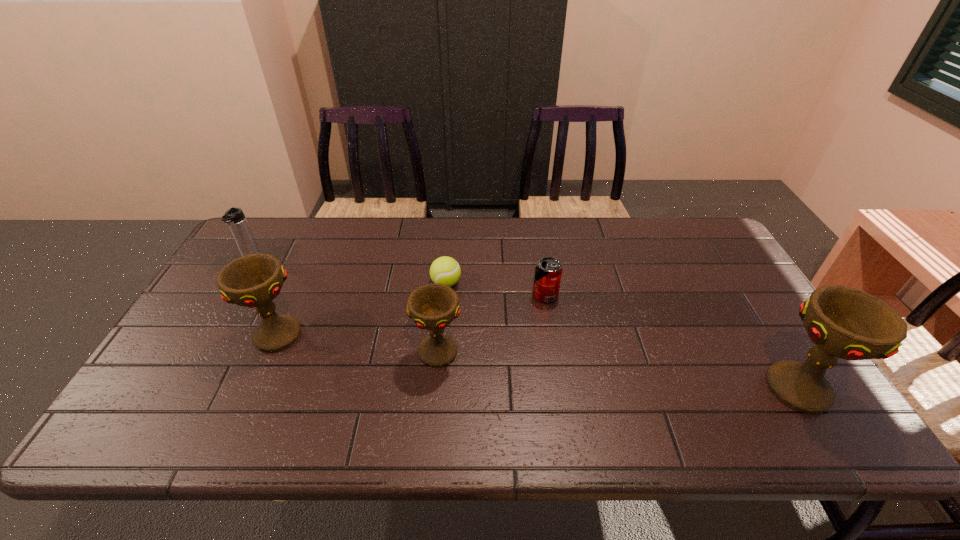
This screenshot has height=540, width=960. In order to click on object present at the near right corner in this screenshot , I will do `click(843, 322)`.

In the image, there is a desktop. Identify the location of vacant space at the far edge. The width and height of the screenshot is (960, 540). (306, 256).

I want to click on vacant space at the near edge of the desktop, so click(x=638, y=403).

Identify the location of vacant area at the left edge. (218, 367).

Find the location of a particular element. free spot at the right edge of the desktop is located at coordinates click(734, 291).

Locate an element on the screen. free location at the far left corner of the desktop is located at coordinates (300, 221).

Where is `vacant space at the near left corner of the desktop`? The width and height of the screenshot is (960, 540). vacant space at the near left corner of the desktop is located at coordinates [206, 378].

Locate an element on the screen. This screenshot has width=960, height=540. vacant space at the near right corner is located at coordinates (754, 398).

Identify the location of free spot between the shortest object and the rightmost chalice. (622, 335).

This screenshot has width=960, height=540. Identify the location of free space between the tennis ball and the soda can. (495, 289).